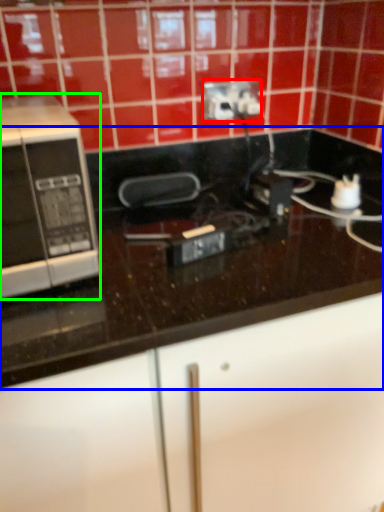
Question: Which is nearer to the power plugs and sockets (highlighted by a red box)? countertop (highlighted by a blue box) or microwave oven (highlighted by a green box).

Choices:
 (A) countertop
 (B) microwave oven

Answer: (A)